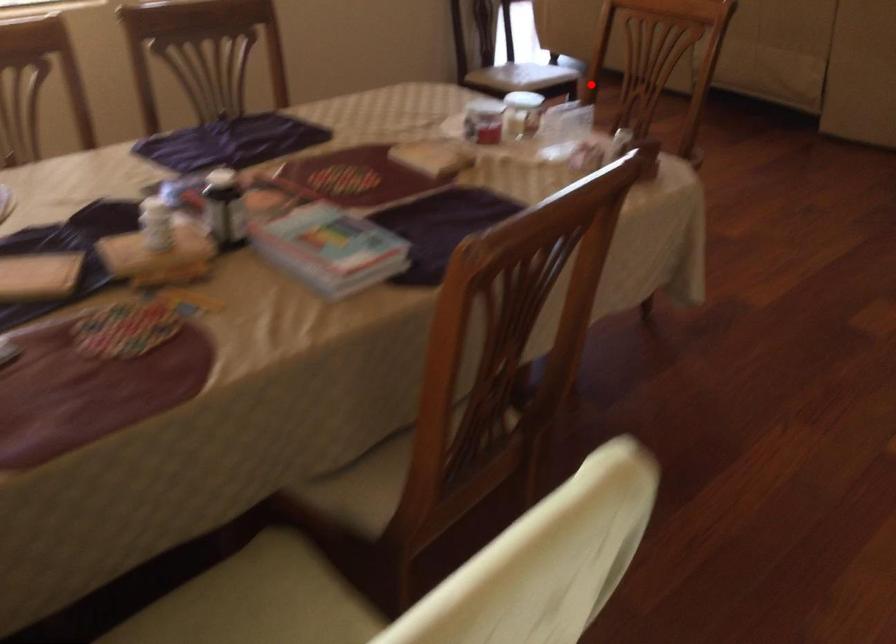
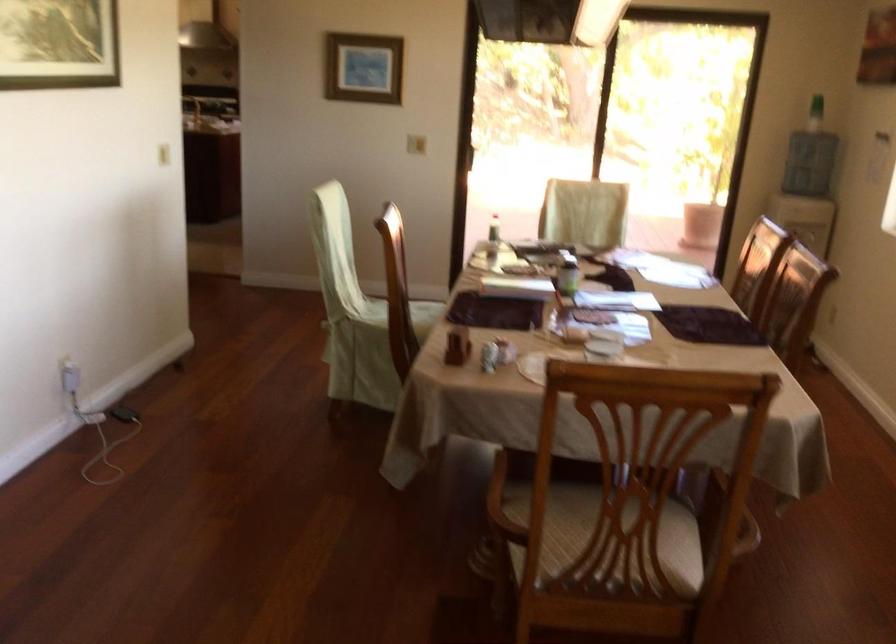
Locate, in the second image, the point that corresponds to the highlighted location in the first image.

(722, 509)